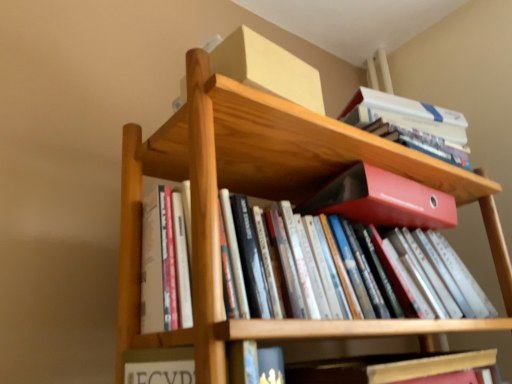
Question: Should I look upward or downward to see white paperback book at upper right, the first book from the back?

Choices:
 (A) down
 (B) up

Answer: (B)

Question: Does wooden bookshelf at center have a smaller size compared to matte red folder at center?

Choices:
 (A) yes
 (B) no

Answer: (B)

Question: From a real-world perspective, is wooden bookshelf at center positioned over matte red folder at center based on gravity?

Choices:
 (A) yes
 (B) no

Answer: (B)

Question: Can you confirm if wooden bookshelf at center is thinner than matte red folder at center?

Choices:
 (A) no
 (B) yes

Answer: (B)

Question: Can you confirm if wooden bookshelf at center is wider than matte red folder at center?

Choices:
 (A) no
 (B) yes

Answer: (A)

Question: Is wooden bookshelf at center oriented away from matte red folder at center?

Choices:
 (A) yes
 (B) no

Answer: (B)

Question: Is wooden bookshelf at center touching matte red folder at center?

Choices:
 (A) no
 (B) yes

Answer: (A)

Question: Does hardcover book at lower center, which ranks as the second book in back-to-front order, have a lesser width compared to wooden bookshelf at center?

Choices:
 (A) no
 (B) yes

Answer: (A)

Question: From the image's perspective, is hardcover book at lower center, positioned as the first book in front-to-back order, under wooden bookshelf at center?

Choices:
 (A) yes
 (B) no

Answer: (A)

Question: Is hardcover book at lower center, positioned as the second book in top-to-bottom order, not inside wooden bookshelf at center?

Choices:
 (A) yes
 (B) no

Answer: (A)

Question: Is wooden bookshelf at center completely or partially inside hardcover book at lower center, which is counted as the first book, starting from the bottom?

Choices:
 (A) no
 (B) yes

Answer: (A)

Question: Is hardcover book at lower center, which is counted as the first book, starting from the bottom, not near wooden bookshelf at center?

Choices:
 (A) yes
 (B) no

Answer: (B)

Question: Considering the relative sizes of hardcover book at lower center, which ranks as the second book in back-to-front order, and wooden bookshelf at center in the image provided, is hardcover book at lower center, which ranks as the second book in back-to-front order, smaller than wooden bookshelf at center?

Choices:
 (A) yes
 (B) no

Answer: (A)

Question: From a real-world perspective, is white paperback book at upper right, positioned as the first book in top-to-bottom order, on top of hardcover book at lower center, positioned as the first book in front-to-back order?

Choices:
 (A) yes
 (B) no

Answer: (A)